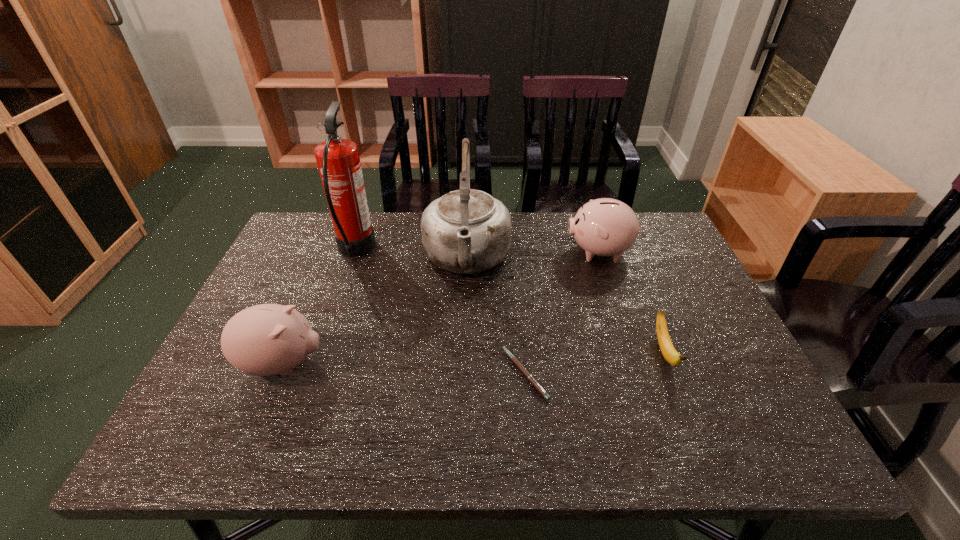
The image size is (960, 540). In order to click on vacant area in the image that satisfies the following two spatial constraints: 1. at the stem of the fifth tallest object; 2. at the snout of the nearer piggy bank in this screenshot , I will do coord(668,364).

The height and width of the screenshot is (540, 960). Find the location of `free space that satisfies the following two spatial constraints: 1. at the stem of the second shortest object; 2. at the snout of the nearer piggy bank`. free space that satisfies the following two spatial constraints: 1. at the stem of the second shortest object; 2. at the snout of the nearer piggy bank is located at coordinates click(668, 364).

Locate an element on the screen. This screenshot has height=540, width=960. vacant space that satisfies the following two spatial constraints: 1. on the front side of the right piggy bank; 2. at the snout of the left piggy bank is located at coordinates (640, 364).